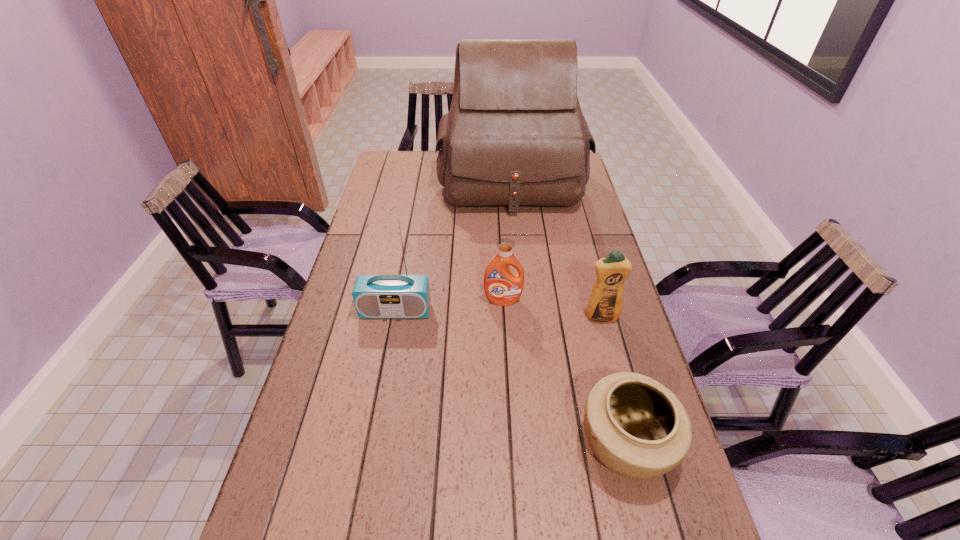
Locate an element on the screen. This screenshot has width=960, height=540. free space at the far left corner is located at coordinates (411, 157).

Image resolution: width=960 pixels, height=540 pixels. In order to click on vacant area between the left detergent and the nearest object in this screenshot , I will do `click(564, 373)`.

Locate an element on the screen. vacant point located between the nearer detergent and the farther detergent is located at coordinates (552, 309).

The width and height of the screenshot is (960, 540). I want to click on unoccupied area between the tallest object and the fourth shortest object, so click(x=453, y=246).

Locate an element on the screen. This screenshot has width=960, height=540. vacant area between the second tallest object and the pottery is located at coordinates (511, 378).

Locate an element on the screen. object that stands as the third closest to the pottery is located at coordinates (375, 296).

Locate an element on the screen. the closest object to the radio receiver is located at coordinates (502, 286).